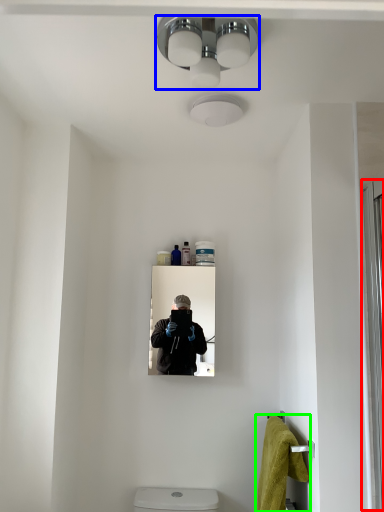
Question: Based on their relative distances, which object is nearer to screen door (highlighted by a red box)? Choose from light fixture (highlighted by a blue box) and bath towel (highlighted by a green box).

Choices:
 (A) light fixture
 (B) bath towel

Answer: (B)